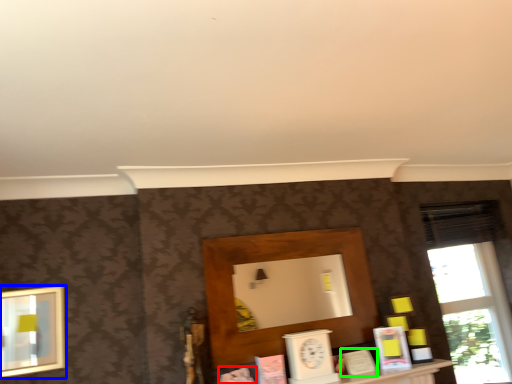
Question: Which is nearer to the book (highlighted by a red box)? picture frame (highlighted by a blue box) or book (highlighted by a green box).

Choices:
 (A) picture frame
 (B) book

Answer: (B)